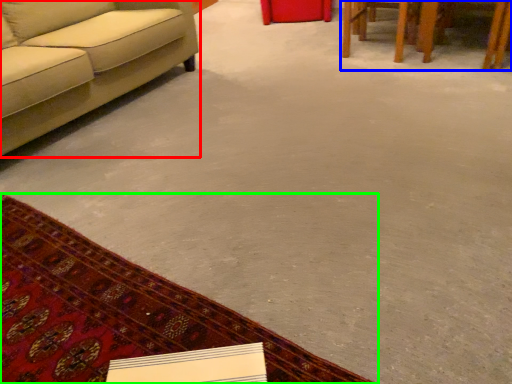
Question: Which object is the closest to the studio couch (highlighted by a red box)? Choose among these: table (highlighted by a blue box) or mat (highlighted by a green box).

Choices:
 (A) table
 (B) mat

Answer: (B)